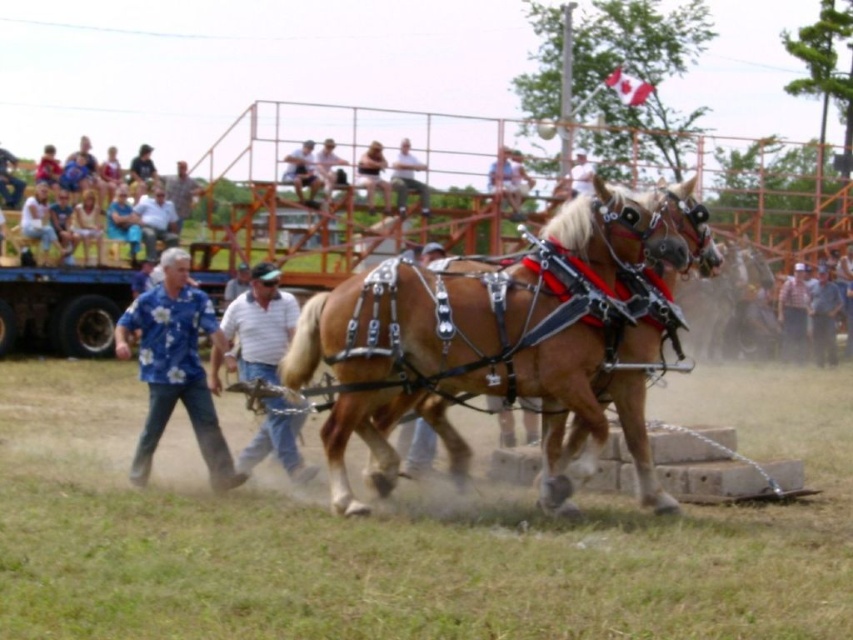
Which is more to the right, brown leather harness at center or light blue shirt at upper center?

brown leather harness at center is more to the right.

Does brown leather harness at center appear on the left side of light blue shirt at upper center?

No, brown leather harness at center is not to the left of light blue shirt at upper center.

Locate an element on the screen. brown leather harness at center is located at coordinates [x=508, y=336].

What are the coordinates of `brown leather harness at center` in the screenshot? It's located at (508, 336).

Does brown leather harness at center have a greater height compared to blue floral shirt at upper left?

Correct, brown leather harness at center is much taller as blue floral shirt at upper left.

Between brown leather harness at center and blue floral shirt at upper left, which one has more height?

brown leather harness at center

Is point (628, 435) behind point (154, 240)?

That is False.

Identify the location of brown leather harness at center. This screenshot has width=853, height=640. (508, 336).

Based on the photo, between brown leather harness at center and blue floral shirt at left, which one has less height?

With less height is blue floral shirt at left.

Based on the photo, between brown leather harness at center and blue floral shirt at left, which one has more height?

brown leather harness at center is taller.

Locate an element on the screen. This screenshot has height=640, width=853. brown leather harness at center is located at coordinates pyautogui.click(x=508, y=336).